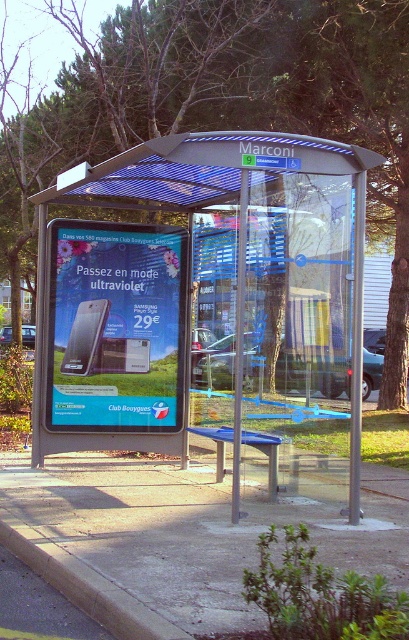
You are a delivery driver who needs to place a matte black phone at center and a yellow painted concrete curb at lower left into two separate boxes. The box for the phone must be larger than the box for the curb. Which object should go into the larger box?

The matte black phone at center is bigger than the yellow painted concrete curb at lower left, so the larger box should contain the matte black phone at center.

You are a delivery person who needs to load a tall package into your van. The package is 2 meters tall. You are standing at the transparent glass bus stop at center. Can you determine if the yellow painted concrete curb at lower left is taller than the bus stop to safely place the package?

The transparent glass bus stop at center is much taller than the yellow painted concrete curb at lower left, so the curb is not taller. Therefore, placing the 2m package might not be safe as the bus stop is taller and could obstruct the loading process.

You are a delivery person carrying a package that is 3 meters long. You need to place it between the matte black phone at center and the yellow painted concrete curb at lower left. Is there enough space to fit the package between them?

The distance between the matte black phone at center and the yellow painted concrete curb at lower left is 3.07 meters. Since the package is 3 meters long, there is enough space to fit it between them with a small amount of extra room.